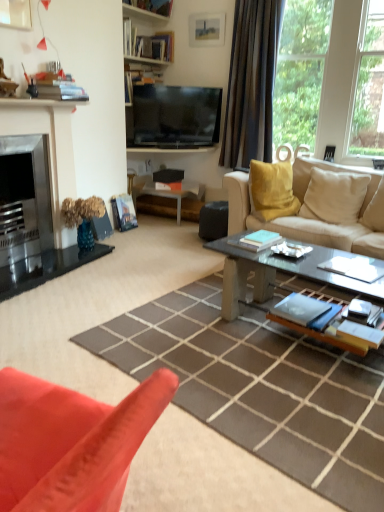
Question: Is wooden bookshelf at upper center taller than beige fabric couch at center?

Choices:
 (A) no
 (B) yes

Answer: (A)

Question: From the image's perspective, is wooden bookshelf at upper center below beige fabric couch at center?

Choices:
 (A) no
 (B) yes

Answer: (A)

Question: Is wooden bookshelf at upper center outside of beige fabric couch at center?

Choices:
 (A) no
 (B) yes

Answer: (B)

Question: Considering the relative sizes of wooden bookshelf at upper center and beige fabric couch at center in the image provided, is wooden bookshelf at upper center bigger than beige fabric couch at center?

Choices:
 (A) no
 (B) yes

Answer: (A)

Question: Does wooden bookshelf at upper center have a greater width compared to beige fabric couch at center?

Choices:
 (A) no
 (B) yes

Answer: (A)

Question: Considering the positions of point (167, 19) and point (218, 30), is point (167, 19) closer or farther from the camera than point (218, 30)?

Choices:
 (A) farther
 (B) closer

Answer: (A)

Question: From the image's perspective, relative to matte white picture frame at upper center, is wooden bookshelf at upper center above or below?

Choices:
 (A) above
 (B) below

Answer: (A)

Question: In the image, is wooden bookshelf at upper center on the left side or the right side of matte white picture frame at upper center?

Choices:
 (A) right
 (B) left

Answer: (B)

Question: In the image, is wooden bookshelf at upper center positioned in front of or behind matte white picture frame at upper center?

Choices:
 (A) behind
 (B) front

Answer: (B)

Question: Considering the positions of point (294, 263) and point (365, 224), is point (294, 263) closer or farther from the camera than point (365, 224)?

Choices:
 (A) farther
 (B) closer

Answer: (B)

Question: From a real-world perspective, relative to beige fabric couch at center, is glass concrete coffee table at center vertically above or below?

Choices:
 (A) below
 (B) above

Answer: (A)

Question: From the image's perspective, is glass concrete coffee table at center located above or below beige fabric couch at center?

Choices:
 (A) below
 (B) above

Answer: (A)

Question: In terms of height, does glass concrete coffee table at center look taller or shorter compared to beige fabric couch at center?

Choices:
 (A) tall
 (B) short

Answer: (B)

Question: Is brushed metal fireplace at left inside the boundaries of white glossy side table at center, or outside?

Choices:
 (A) outside
 (B) inside

Answer: (A)

Question: Considering the positions of brushed metal fireplace at left and white glossy side table at center in the image, is brushed metal fireplace at left taller or shorter than white glossy side table at center?

Choices:
 (A) short
 (B) tall

Answer: (B)